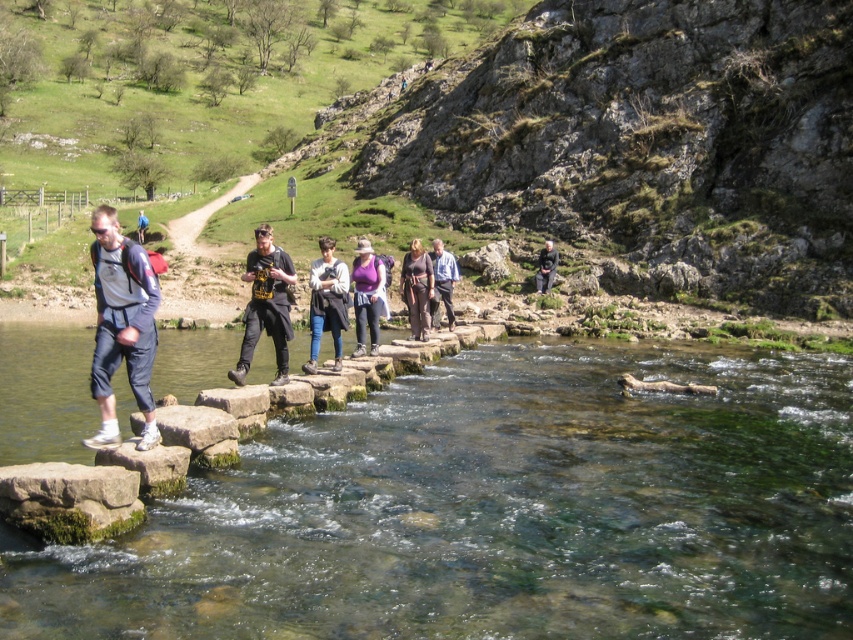
You are a hiker trying to cross the river using the stepping stones. You notice a dark gray fabric jacket at center and denim pants at center on the path. If your backpack is 1.5 meters long, can you safely carry both items while walking on the stepping stones without dropping them?

The distance between the dark gray fabric jacket at center and denim pants at center is 1.73 meters, which is greater than the backpack length of 1.5 meters. Therefore, you can safely carry both items without dropping them.

You are a hiker trying to cross the river using the stepping stones. You notice the clear stone stepping stones at center and the matte gray backpack at left. Which object is closer to you as you stand on the first stepping stone?

The clear stone stepping stones at center are closer to you than the matte gray backpack at left because they are positioned in front of the backpack in the scene.

You are a hiker trying to cross the shallow river using the clear stone stepping stones at center. If you start from the left bank, which direction should you move to reach the stepping stones?

The clear stone stepping stones at center are positioned at point (496, 509), so you should move towards the center of the river to reach them.